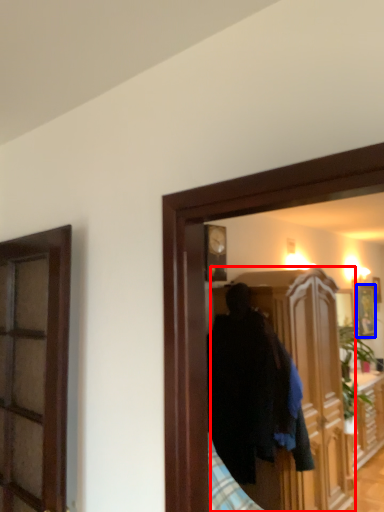
Question: Which object appears farthest to the camera in this image, cabinetry (highlighted by a red box) or picture frame (highlighted by a blue box)?

Choices:
 (A) cabinetry
 (B) picture frame

Answer: (B)